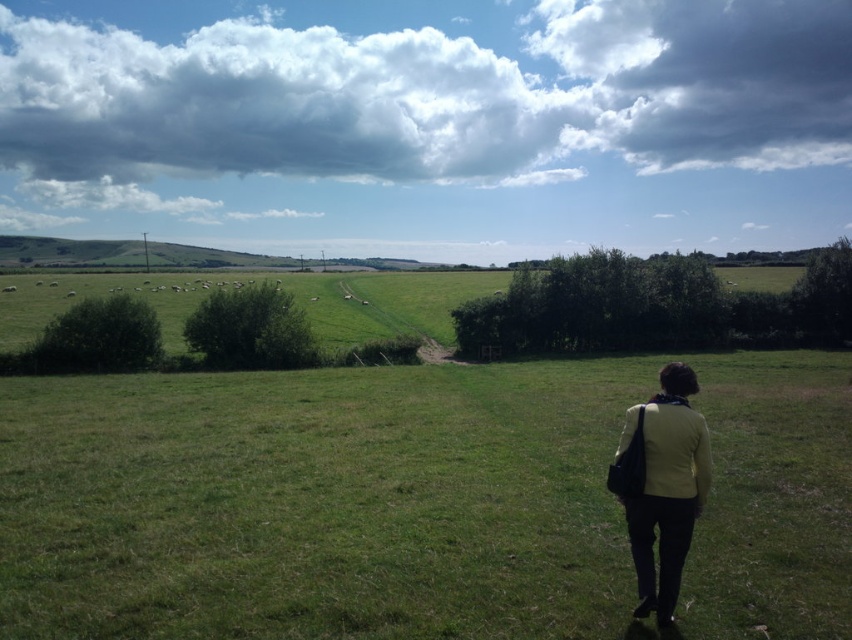
Is green grassy field at center wider than cloudy sky at upper center?

Incorrect, green grassy field at center's width does not surpass cloudy sky at upper center's.

This screenshot has height=640, width=852. Find the location of `green grassy field at center`. green grassy field at center is located at coordinates (412, 500).

This screenshot has height=640, width=852. I want to click on green grassy field at center, so click(412, 500).

Does cloudy sky at upper center have a lesser width compared to light yellow fabric jacket at lower right?

No, cloudy sky at upper center is not thinner than light yellow fabric jacket at lower right.

Who is lower down, cloudy sky at upper center or light yellow fabric jacket at lower right?

light yellow fabric jacket at lower right is lower down.

Locate an element on the screen. cloudy sky at upper center is located at coordinates (429, 93).

At what (x,y) coordinates should I click in order to perform the action: click on cloudy sky at upper center. Please return your answer as a coordinate pair (x, y). The height and width of the screenshot is (640, 852). Looking at the image, I should click on (429, 93).

Can you confirm if green grassy field at center is taller than light yellow fabric jacket at lower right?

Correct, green grassy field at center is much taller as light yellow fabric jacket at lower right.

Which is more to the left, green grassy field at center or light yellow fabric jacket at lower right?

light yellow fabric jacket at lower right

Is point (727, 458) positioned after point (659, 621)?

Yes, it is behind point (659, 621).

Find the location of a particular element. The width and height of the screenshot is (852, 640). green grassy field at center is located at coordinates (412, 500).